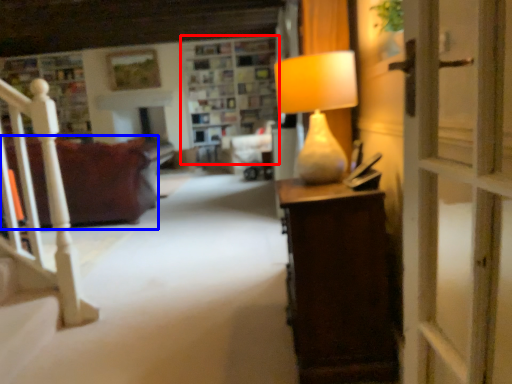
Question: Which object appears farthest to the camera in this image, shelf (highlighted by a red box) or studio couch (highlighted by a blue box)?

Choices:
 (A) shelf
 (B) studio couch

Answer: (A)